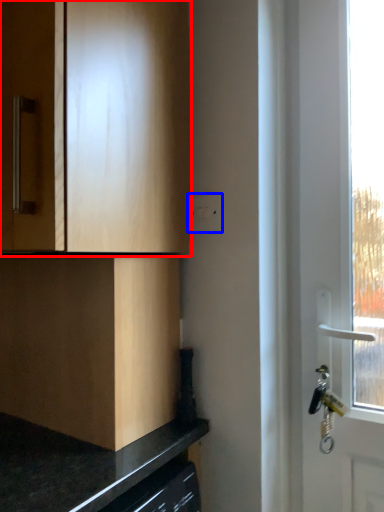
Question: Which object appears closest to the camera in this image, cabinetry (highlighted by a red box) or electric outlet (highlighted by a blue box)?

Choices:
 (A) cabinetry
 (B) electric outlet

Answer: (A)